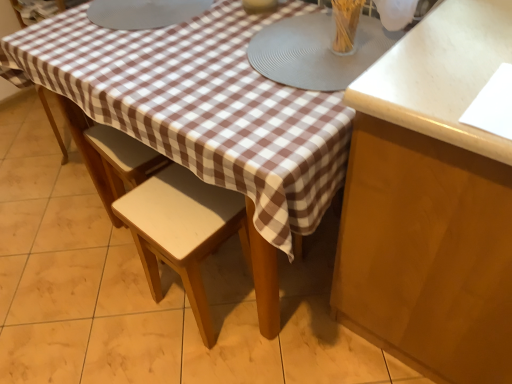
Identify the location of vacant space that is to the left of light beige wood stool at center. This screenshot has height=384, width=512. (123, 313).